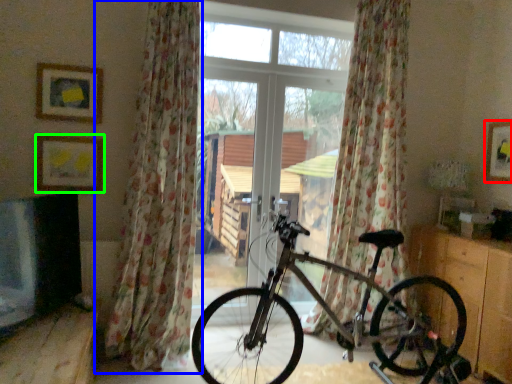
Question: Which object is the farthest from picture frame (highlighted by a red box)? Choose among these: curtain (highlighted by a blue box) or picture frame (highlighted by a green box).

Choices:
 (A) curtain
 (B) picture frame

Answer: (B)